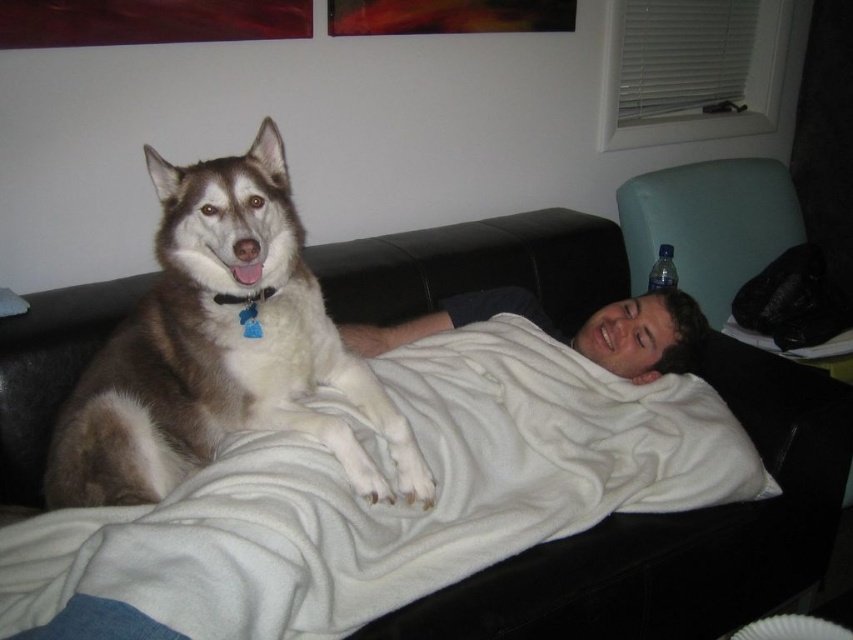
Can you confirm if brown and white fur at center is positioned to the right of white soft blanket at center?

In fact, brown and white fur at center is to the left of white soft blanket at center.

Consider the image. Who is shorter, brown and white fur at center or white soft blanket at center?

white soft blanket at center is shorter.

What do you see at coordinates (219, 348) in the screenshot? The height and width of the screenshot is (640, 853). I see `brown and white fur at center` at bounding box center [219, 348].

This screenshot has height=640, width=853. What are the coordinates of `brown and white fur at center` in the screenshot? It's located at (219, 348).

Image resolution: width=853 pixels, height=640 pixels. Identify the location of white fleece blanket at center. (396, 500).

Who is more distant from viewer, (210, 563) or (134, 493)?

Point (134, 493)

Image resolution: width=853 pixels, height=640 pixels. Identify the location of white fleece blanket at center. (396, 500).

Can you confirm if white fleece blanket at center is smaller than white soft blanket at center?

No, white fleece blanket at center is not smaller than white soft blanket at center.

Between white fleece blanket at center and white soft blanket at center, which one has less height?

white soft blanket at center is shorter.

The width and height of the screenshot is (853, 640). What do you see at coordinates (396, 500) in the screenshot?
I see `white fleece blanket at center` at bounding box center [396, 500].

Image resolution: width=853 pixels, height=640 pixels. I want to click on white fleece blanket at center, so click(396, 500).